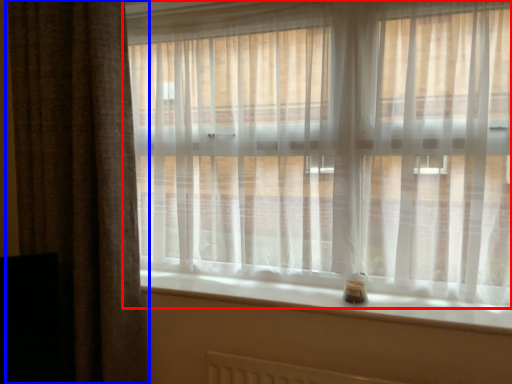
Question: Which of the following is the closest to the observer, curtain (highlighted by a red box) or curtain (highlighted by a blue box)?

Choices:
 (A) curtain
 (B) curtain

Answer: (A)